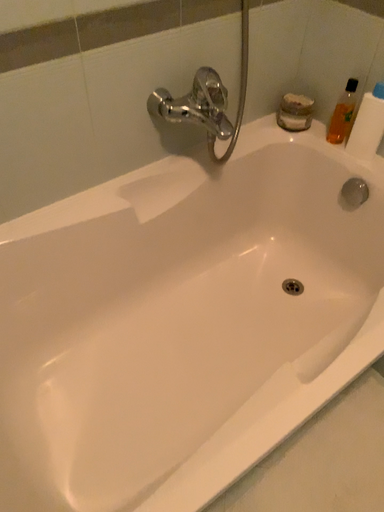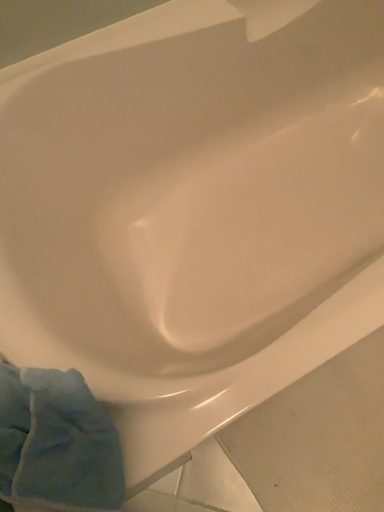
Question: Which way did the camera rotate in the video?

Choices:
 (A) rotated upward
 (B) rotated downward

Answer: (B)